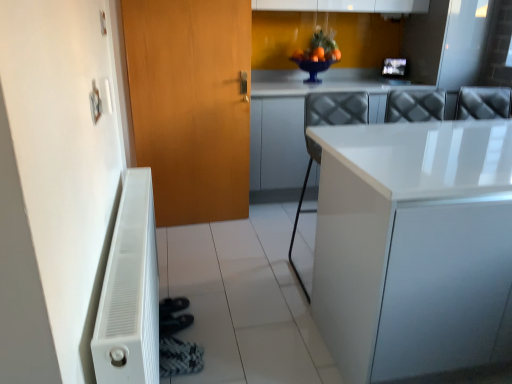
Find the location of a particular element. The height and width of the screenshot is (384, 512). vacant space that's between white glossy chair at center and black textured shoe at lower left is located at coordinates (249, 320).